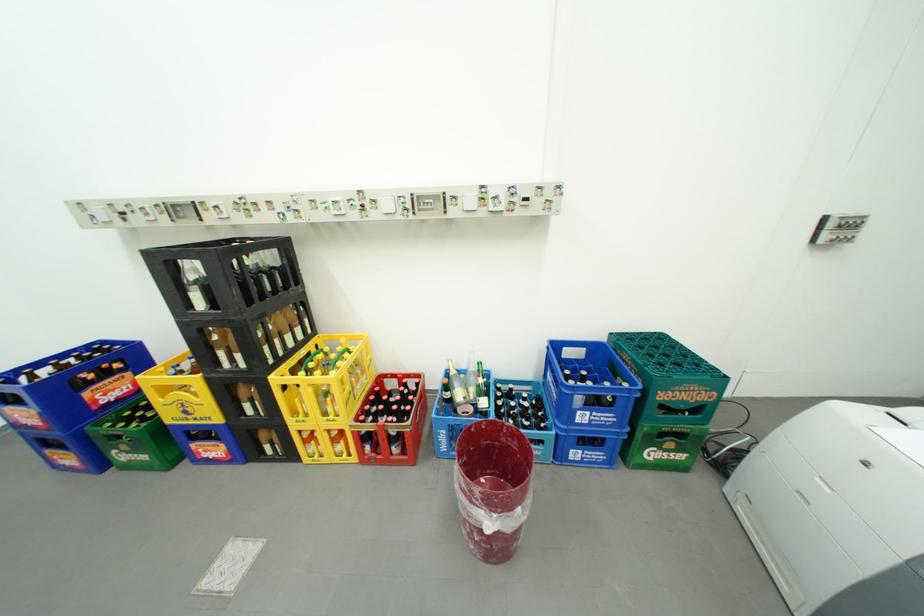
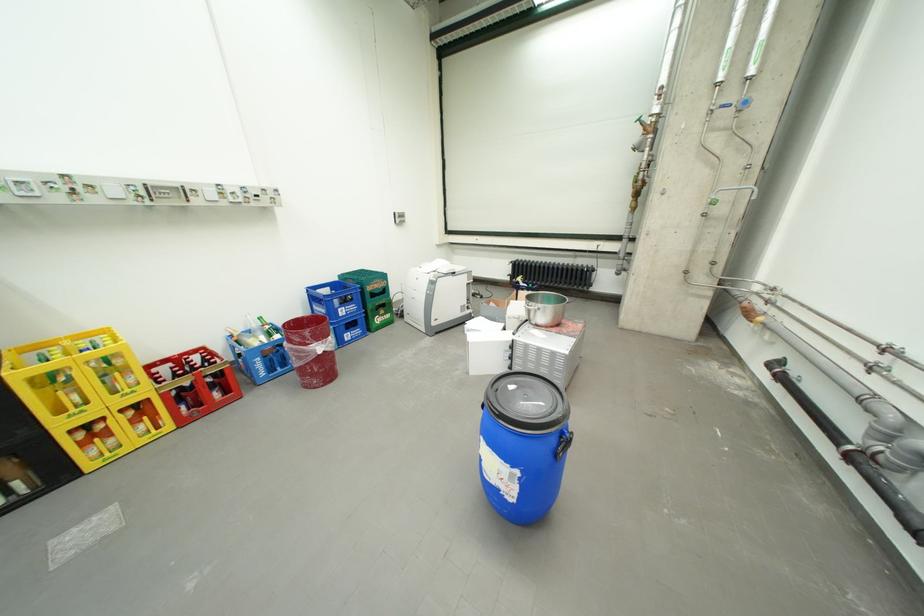
In the second image, find the point that corresponds to [286,379] in the first image.

(30, 374)